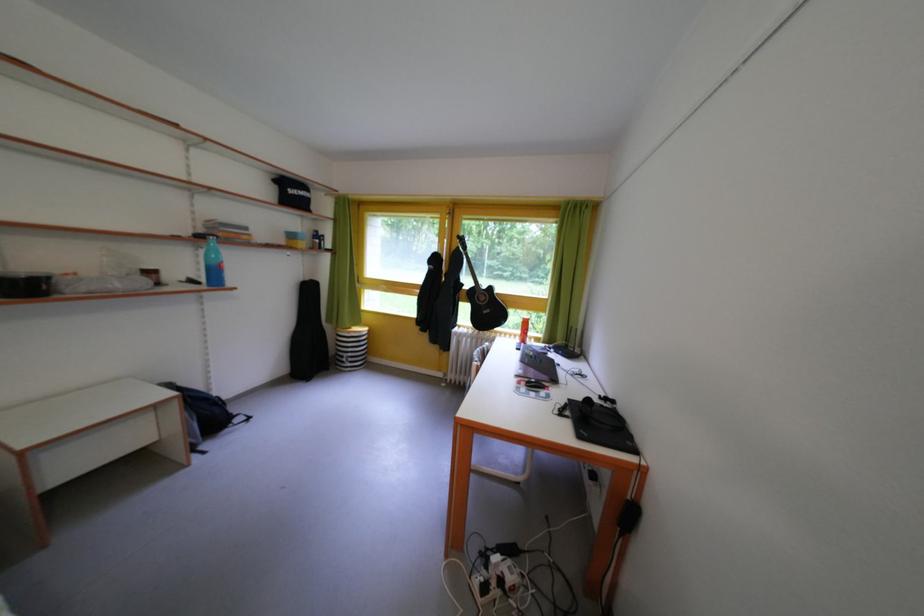
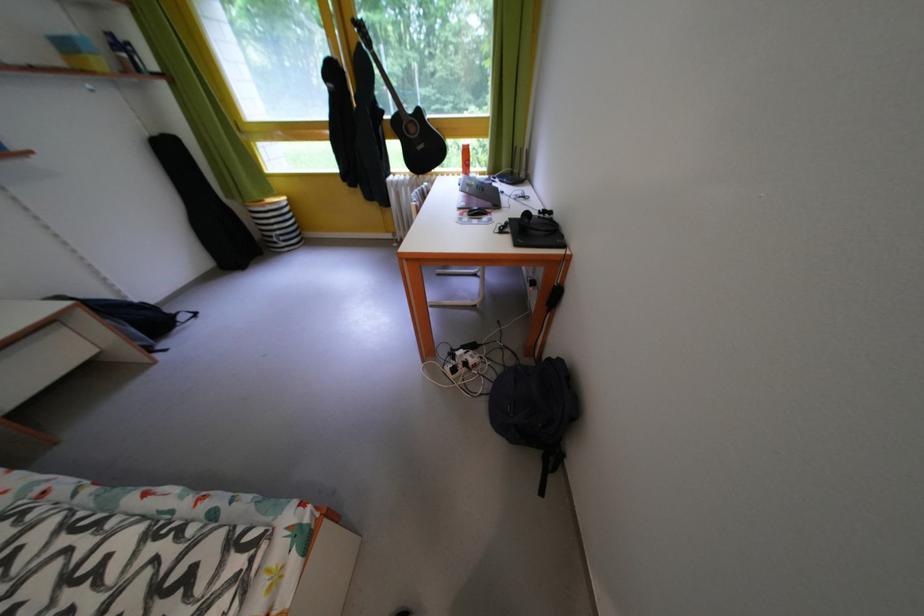
Question: How did the camera likely rotate?

Choices:
 (A) Left
 (B) Right
 (C) Up
 (D) Down

Answer: (D)